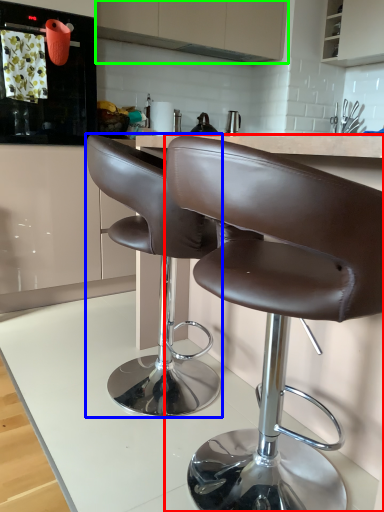
Question: Which object is positioned farthest from chair (highlighted by a red box)? Select from chair (highlighted by a blue box) and cabinetry (highlighted by a green box).

Choices:
 (A) chair
 (B) cabinetry

Answer: (B)